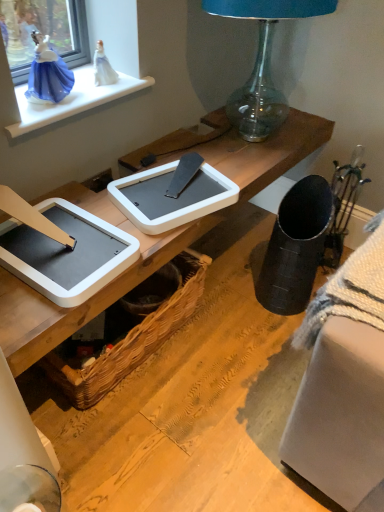
Find the location of a particular element. This screenshot has height=512, width=384. white plastic tablet at center, acting as the second tablet computer starting from the right is located at coordinates 67,253.

Where is `woven brown picnic basket at lower center`? The width and height of the screenshot is (384, 512). woven brown picnic basket at lower center is located at coordinates (132, 340).

At what (x,y) coordinates should I click in order to perform the action: click on white glossy window sill at upper left. Please return your answer as a coordinate pair (x, y). Looking at the image, I should click on (73, 100).

This screenshot has height=512, width=384. Identify the location of white plastic tablet at center, acting as the second tablet computer starting from the right. (67, 253).

Based on the photo, can you tell me how much white plastic tablet at center, acting as the second tablet computer starting from the right, and transparent glass lamp at upper center differ in facing direction?

They differ by 5.92 degrees in their facing directions.

Based on the photo, from a real-world perspective, is white plastic tablet at center, acting as the first tablet computer starting from the left, positioned over transparent glass lamp at upper center based on gravity?

No, from a real-world perspective, white plastic tablet at center, acting as the first tablet computer starting from the left, is not over transparent glass lamp at upper center

Between white plastic tablet at center, acting as the first tablet computer starting from the left, and transparent glass lamp at upper center, which one appears on the left side from the viewer's perspective?

Positioned to the left is white plastic tablet at center, acting as the first tablet computer starting from the left.

Is white plastic tablet at center, acting as the first tablet computer starting from the left, facing towards transparent glass lamp at upper center?

No.

Between white glossy window sill at upper left and woven brown picnic basket at lower center, which one has larger size?

woven brown picnic basket at lower center is bigger.

Considering the positions of point (74, 108) and point (46, 371), is point (74, 108) closer or farther from the camera than point (46, 371)?

Point (74, 108).

Considering the relative positions of white glossy window sill at upper left and woven brown picnic basket at lower center in the image provided, is white glossy window sill at upper left to the left or to the right of woven brown picnic basket at lower center?

Clearly, white glossy window sill at upper left is on the left of woven brown picnic basket at lower center in the image.

Considering the relative sizes of white plastic tablet at center, acting as the second tablet computer starting from the right, and woven brown picnic basket at lower center in the image provided, is white plastic tablet at center, acting as the second tablet computer starting from the right, smaller than woven brown picnic basket at lower center?

Yes, white plastic tablet at center, acting as the second tablet computer starting from the right, is smaller than woven brown picnic basket at lower center.

Which object is thinner, white plastic tablet at center, acting as the first tablet computer starting from the left, or woven brown picnic basket at lower center?

woven brown picnic basket at lower center.

Find the location of a particular element. The height and width of the screenshot is (512, 384). picnic basket that appears below the transparent glass lamp at upper center (from a real-world perspective) is located at coordinates (132, 340).

Considering the relative positions of woven brown picnic basket at lower center and transparent glass lamp at upper center in the image provided, is woven brown picnic basket at lower center to the right of transparent glass lamp at upper center from the viewer's perspective?

In fact, woven brown picnic basket at lower center is to the left of transparent glass lamp at upper center.

Is transparent glass lamp at upper center surrounded by woven brown picnic basket at lower center?

Definitely not — transparent glass lamp at upper center is not inside woven brown picnic basket at lower center.

Between woven brown picnic basket at lower center and transparent glass lamp at upper center, which one has larger width?

transparent glass lamp at upper center.

Looking at their sizes, would you say white glossy window sill at upper left is wider or thinner than transparent glass lamp at upper center?

white glossy window sill at upper left is thinner than transparent glass lamp at upper center.

Identify the location of window sill located underneath the transparent glass lamp at upper center (from a real-world perspective). The image size is (384, 512). (73, 100).

Considering the sizes of woven brown picnic basket at lower center and white plastic tablet at center, acting as the first tablet computer starting from the left, in the image, is woven brown picnic basket at lower center taller or shorter than white plastic tablet at center, acting as the first tablet computer starting from the left,?

Considering their sizes, woven brown picnic basket at lower center has more height than white plastic tablet at center, acting as the first tablet computer starting from the left.

Can you tell me how much woven brown picnic basket at lower center and white plastic tablet at center, acting as the first tablet computer starting from the left, differ in facing direction?

There is a 5.48-degree angle between the facing directions of woven brown picnic basket at lower center and white plastic tablet at center, acting as the first tablet computer starting from the left.

Looking at their sizes, would you say woven brown picnic basket at lower center is wider or thinner than white plastic tablet at center, acting as the second tablet computer starting from the right?

In the image, woven brown picnic basket at lower center appears to be more narrow than white plastic tablet at center, acting as the second tablet computer starting from the right.

Which object is positioned more to the right, woven brown picnic basket at lower center or white plastic tablet at center, acting as the first tablet computer starting from the left?

Positioned to the right is woven brown picnic basket at lower center.

Is white plastic tablet at center, the 1th tablet computer positioned from the right, directly adjacent to woven brown picnic basket at lower center?

No, white plastic tablet at center, the 1th tablet computer positioned from the right, is not with woven brown picnic basket at lower center.

In order to click on tablet computer that is the 2nd one when counting upward from the woven brown picnic basket at lower center (from the image's perspective) in this screenshot , I will do `click(169, 197)`.

Does white plastic tablet at center, which is the second tablet computer in left-to-right order, have a lesser width compared to woven brown picnic basket at lower center?

No.

Where is `tablet computer in front of the transparent glass lamp at upper center`? tablet computer in front of the transparent glass lamp at upper center is located at coordinates (67, 253).

The height and width of the screenshot is (512, 384). I want to click on picnic basket behind the white glossy window sill at upper left, so click(132, 340).

Estimate the real-world distances between objects in this image. Which object is closer to white plastic tablet at center, the 1th tablet computer positioned from the right, transparent glass lamp at upper center or white glossy window sill at upper left?

white glossy window sill at upper left lies closer to white plastic tablet at center, the 1th tablet computer positioned from the right, than the other object.

Looking at the image, which one is located closer to woven brown picnic basket at lower center, white plastic tablet at center, which is the second tablet computer in left-to-right order, or transparent glass lamp at upper center?

Based on the image, white plastic tablet at center, which is the second tablet computer in left-to-right order, appears to be nearer to woven brown picnic basket at lower center.

Looking at this image, looking at the image, which one is located closer to transparent glass lamp at upper center, white glossy window sill at upper left or white plastic tablet at center, acting as the first tablet computer starting from the left?

white glossy window sill at upper left is closer to transparent glass lamp at upper center.

Considering their positions, is white glossy window sill at upper left positioned closer to transparent glass lamp at upper center than woven brown picnic basket at lower center?

white glossy window sill at upper left is positioned closer to the anchor transparent glass lamp at upper center.

When comparing their distances from woven brown picnic basket at lower center, does white plastic tablet at center, acting as the first tablet computer starting from the left, or white glossy window sill at upper left seem further?

Based on the image, white glossy window sill at upper left appears to be further to woven brown picnic basket at lower center.

Looking at the image, which one is located further to white glossy window sill at upper left, woven brown picnic basket at lower center or transparent glass lamp at upper center?

Among the two, woven brown picnic basket at lower center is located further to white glossy window sill at upper left.

From the image, which object appears to be nearer to white plastic tablet at center, the 1th tablet computer positioned from the right, woven brown picnic basket at lower center or transparent glass lamp at upper center?

woven brown picnic basket at lower center is closer to white plastic tablet at center, the 1th tablet computer positioned from the right.

Based on their spatial positions, is transparent glass lamp at upper center or woven brown picnic basket at lower center further from white plastic tablet at center, acting as the second tablet computer starting from the right?

Based on the image, transparent glass lamp at upper center appears to be further to white plastic tablet at center, acting as the second tablet computer starting from the right.

You are a GUI agent. You are given a task and a screenshot of the screen. Output one action in this format:
    pyautogui.click(x=<x>, y=<y>)
    Task: Click on the tablet computer that lies between white plastic tablet at center, which is the second tablet computer in left-to-right order, and woven brown picnic basket at lower center from top to bottom
    This screenshot has width=384, height=512.
    Given the screenshot: What is the action you would take?
    pyautogui.click(x=67, y=253)

Locate an element on the screen. This screenshot has width=384, height=512. tablet computer located between white plastic tablet at center, acting as the first tablet computer starting from the left, and transparent glass lamp at upper center in the left-right direction is located at coordinates (169, 197).

At what (x,y) coordinates should I click in order to perform the action: click on tablet computer between white glossy window sill at upper left and white plastic tablet at center, acting as the second tablet computer starting from the right, in the vertical direction. Please return your answer as a coordinate pair (x, y). The image size is (384, 512). Looking at the image, I should click on (169, 197).

You are a GUI agent. You are given a task and a screenshot of the screen. Output one action in this format:
    pyautogui.click(x=<x>, y=<y>)
    Task: Click on the window sill between transparent glass lamp at upper center and woven brown picnic basket at lower center from top to bottom
    The width and height of the screenshot is (384, 512).
    Given the screenshot: What is the action you would take?
    pyautogui.click(x=73, y=100)